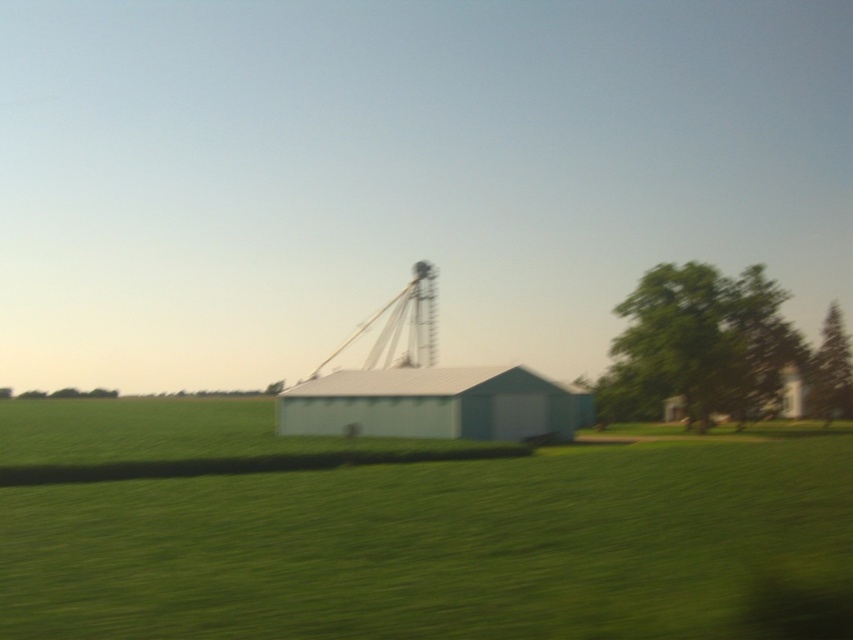
Question: From the image, what is the correct spatial relationship of green grass at center in relation to green textured tree at right?

Choices:
 (A) right
 (B) left

Answer: (B)

Question: Which is farther from the white corrugated metal barn at center?

Choices:
 (A) green grass at center
 (B) green textured tree at right

Answer: (B)

Question: Estimate the real-world distances between objects in this image. Which object is closer to the green grass at center?

Choices:
 (A) green leafy tree at right
 (B) green textured tree at right
 (C) white corrugated metal barn at center

Answer: (C)

Question: Can you confirm if green leafy tree at right is positioned to the left of green textured tree at right?

Choices:
 (A) yes
 (B) no

Answer: (A)

Question: Is white corrugated metal barn at center wider than green textured tree at right?

Choices:
 (A) no
 (B) yes

Answer: (A)

Question: Which object appears farthest from the camera in this image?

Choices:
 (A) green leafy tree at right
 (B) white corrugated metal barn at center

Answer: (A)